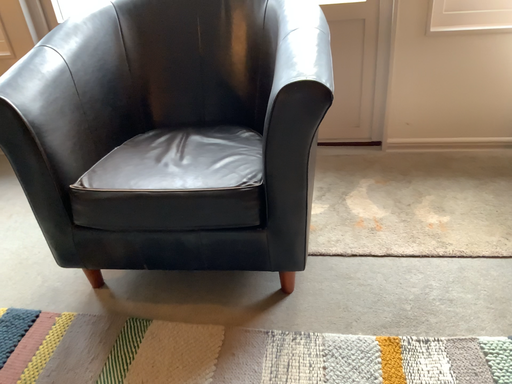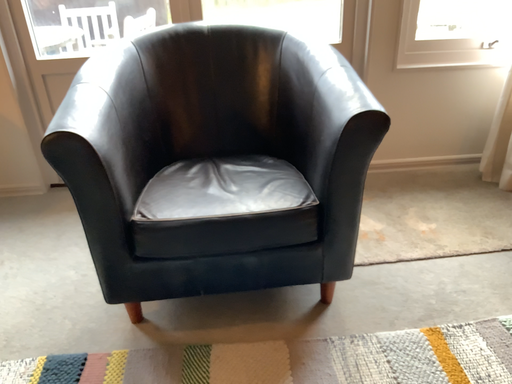
Question: Which way did the camera rotate in the video?

Choices:
 (A) rotated left
 (B) rotated right

Answer: (B)